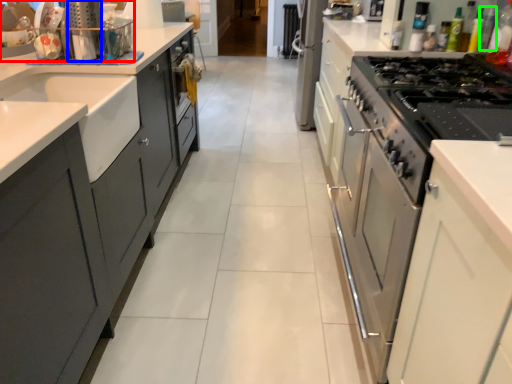
Question: Which object is the closest to the kitchen appliance (highlighted by a red box)? Choose among these: appliance (highlighted by a blue box) or bottle (highlighted by a green box).

Choices:
 (A) appliance
 (B) bottle

Answer: (A)